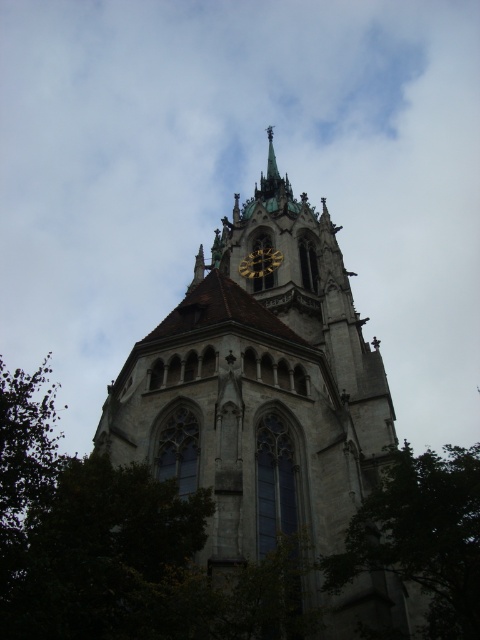
Question: Can you confirm if white cloud at upper center is positioned to the right of stone church tower at center?

Choices:
 (A) yes
 (B) no

Answer: (B)

Question: Is the position of stone church tower at center less distant than that of green leafy tree at lower left?

Choices:
 (A) no
 (B) yes

Answer: (A)

Question: Which point is farther to the camera?

Choices:
 (A) stone church tower at center
 (B) white cloud at upper center

Answer: (B)

Question: Estimate the real-world distances between objects in this image. Which object is closer to the green leafy tree at lower right?

Choices:
 (A) stone church tower at center
 (B) green leafy tree at lower left

Answer: (B)

Question: Is white cloud at upper center to the left of gold metallic clock at center from the viewer's perspective?

Choices:
 (A) no
 (B) yes

Answer: (B)

Question: Among these points, which one is farthest from the camera?

Choices:
 (A) (261, 358)
 (B) (372, 557)
 (C) (240, 269)

Answer: (C)